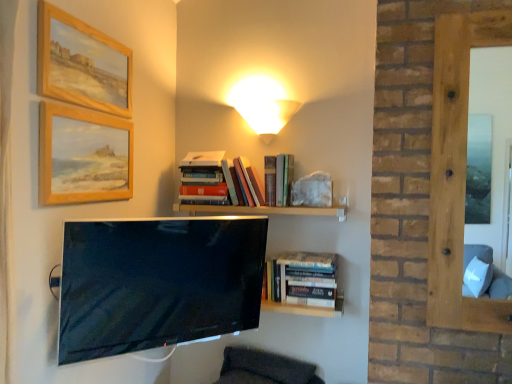
Question: Can you confirm if smooth wooden frame at right is positioned to the left of hardcover books at upper center, the second book positioned from the left?

Choices:
 (A) no
 (B) yes

Answer: (A)

Question: Considering the relative sizes of smooth wooden frame at right and hardcover books at upper center, which is the 2th book from bottom to top, in the image provided, is smooth wooden frame at right thinner than hardcover books at upper center, which is the 2th book from bottom to top,?

Choices:
 (A) yes
 (B) no

Answer: (A)

Question: From the image's perspective, is smooth wooden frame at right beneath hardcover books at upper center, acting as the second book starting from the right?

Choices:
 (A) yes
 (B) no

Answer: (B)

Question: Is smooth wooden frame at right shorter than hardcover books at upper center, acting as the 2th book starting from the top?

Choices:
 (A) yes
 (B) no

Answer: (B)

Question: Is smooth wooden frame at right far away from hardcover books at upper center, which is the 2th book from bottom to top?

Choices:
 (A) no
 (B) yes

Answer: (A)

Question: Is smooth wooden frame at right positioned behind hardcover books at upper center, the second book positioned from the left?

Choices:
 (A) no
 (B) yes

Answer: (A)

Question: Considering the relative sizes of dark gray fabric swivel chair at lower center and hardcover books at center, positioned as the 3th book in top-to-bottom order, in the image provided, is dark gray fabric swivel chair at lower center wider than hardcover books at center, positioned as the 3th book in top-to-bottom order,?

Choices:
 (A) no
 (B) yes

Answer: (A)

Question: From a real-world perspective, is dark gray fabric swivel chair at lower center located higher than hardcover books at center, the 3th book when ordered from left to right?

Choices:
 (A) no
 (B) yes

Answer: (A)

Question: Is dark gray fabric swivel chair at lower center further to camera compared to hardcover books at center, the 3th book when ordered from left to right?

Choices:
 (A) no
 (B) yes

Answer: (B)

Question: Does dark gray fabric swivel chair at lower center have a larger size compared to hardcover books at center, the 3th book when ordered from left to right?

Choices:
 (A) no
 (B) yes

Answer: (A)

Question: Considering the relative sizes of dark gray fabric swivel chair at lower center and hardcover books at center, the first book in the bottom-to-top sequence, in the image provided, is dark gray fabric swivel chair at lower center shorter than hardcover books at center, the first book in the bottom-to-top sequence,?

Choices:
 (A) no
 (B) yes

Answer: (B)

Question: Considering the relative sizes of dark gray fabric swivel chair at lower center and hardcover books at center, which is counted as the first book, starting from the right, in the image provided, is dark gray fabric swivel chair at lower center smaller than hardcover books at center, which is counted as the first book, starting from the right,?

Choices:
 (A) yes
 (B) no

Answer: (A)

Question: Considering the relative sizes of wooden at upper center and hardcover books at center, the 3th book when ordered from left to right, in the image provided, is wooden at upper center bigger than hardcover books at center, the 3th book when ordered from left to right,?

Choices:
 (A) yes
 (B) no

Answer: (B)